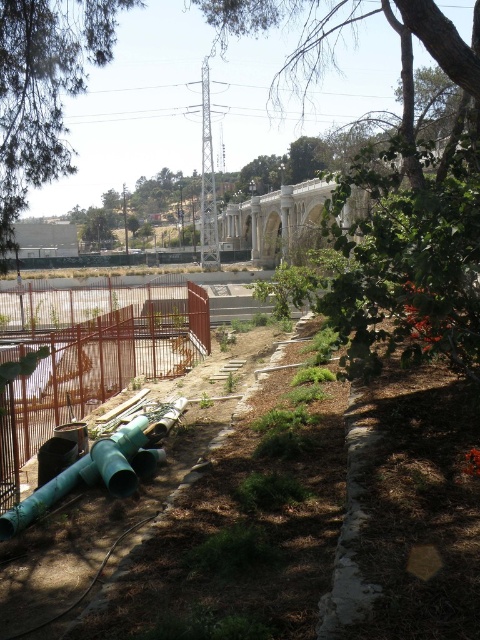
What do you see at coordinates (44, 90) in the screenshot? I see `green leafy tree at upper left` at bounding box center [44, 90].

Which of these two, green leafy tree at upper left or green matte water pipe at lower left, stands shorter?

With less height is green leafy tree at upper left.

Locate an element on the screen. The image size is (480, 640). green leafy tree at upper left is located at coordinates (44, 90).

Does green leafy tree at upper center appear on the right side of green matte water pipe at lower left?

Yes, green leafy tree at upper center is to the right of green matte water pipe at lower left.

Which is behind, point (465, 150) or point (143, 464)?

Point (143, 464)

The height and width of the screenshot is (640, 480). I want to click on green leafy tree at upper center, so click(394, 188).

What do you see at coordinates (92, 356) in the screenshot?
I see `brown metal fence at lower left` at bounding box center [92, 356].

Does point (25, 460) lie behind point (122, 449)?

Yes, point (25, 460) is behind point (122, 449).

Is point (143, 339) less distant than point (120, 445)?

No, (143, 339) is further to viewer.

Identify the location of brown metal fence at lower left. (92, 356).